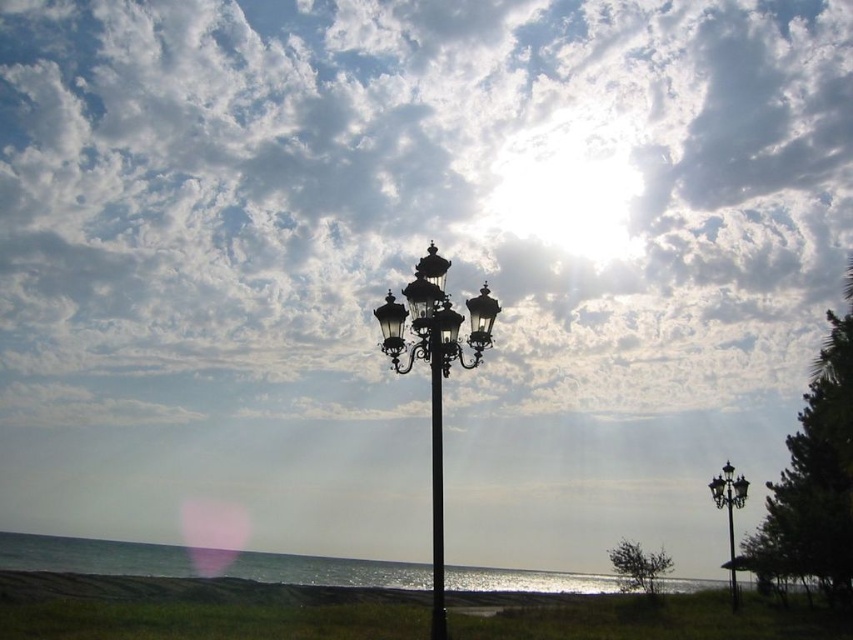
You are standing at the point marked by coordinates point (201, 563). What is the terrain like at that location?

The terrain at point (201, 563) is blue water at lower center.

You are standing on the green grass at lower center and want to walk to the ocean. Which direction should you go relative to the blue water at lower center?

Since the green grass at lower center is in front of the blue water at lower center, you should walk towards the blue water at lower center to reach the ocean.